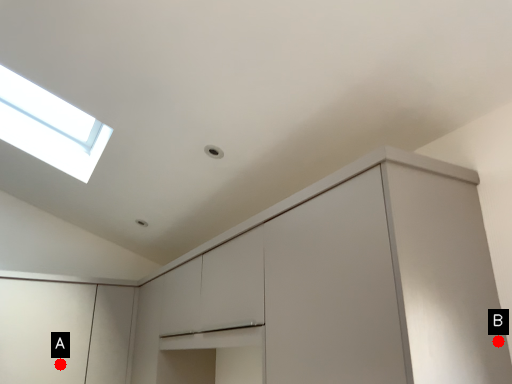
Question: Two points are circled on the image, labeled by A and B beside each circle. Among these points, which one is farthest from the camera?

Choices:
 (A) A is further
 (B) B is further

Answer: (A)